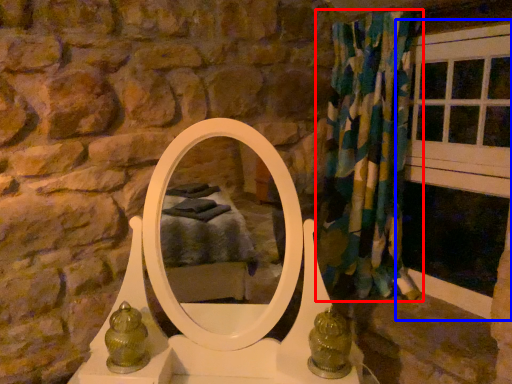
Question: Which of the following is the closest to the observer, curtain (highlighted by a red box) or window frame (highlighted by a blue box)?

Choices:
 (A) curtain
 (B) window frame

Answer: (B)